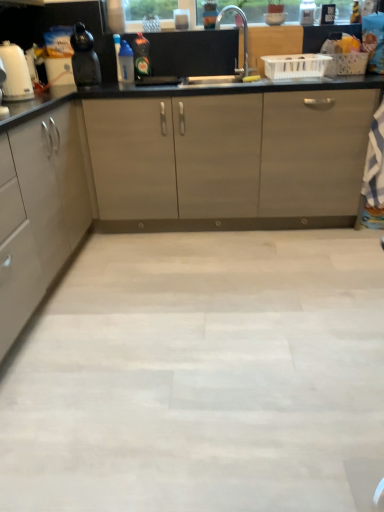
Question: Does matte black kettle at left contain white glossy kettle at left?

Choices:
 (A) yes
 (B) no

Answer: (B)

Question: Can you confirm if matte black kettle at left is shorter than white glossy kettle at left?

Choices:
 (A) no
 (B) yes

Answer: (A)

Question: Is matte black kettle at left behind white glossy kettle at left?

Choices:
 (A) yes
 (B) no

Answer: (A)

Question: Is matte black kettle at left taller than white glossy kettle at left?

Choices:
 (A) yes
 (B) no

Answer: (A)

Question: Is matte black kettle at left turned away from white glossy kettle at left?

Choices:
 (A) no
 (B) yes

Answer: (A)

Question: In terms of height, does silver metallic faucet at upper center look taller or shorter compared to matte gray cabinet at left?

Choices:
 (A) short
 (B) tall

Answer: (A)

Question: From the image's perspective, is silver metallic faucet at upper center located above or below matte gray cabinet at left?

Choices:
 (A) below
 (B) above

Answer: (B)

Question: Considering their positions, is silver metallic faucet at upper center located in front of or behind matte gray cabinet at left?

Choices:
 (A) behind
 (B) front

Answer: (A)

Question: Considering the positions of silver metallic faucet at upper center and matte gray cabinet at left in the image, is silver metallic faucet at upper center bigger or smaller than matte gray cabinet at left?

Choices:
 (A) small
 (B) big

Answer: (A)

Question: Considering the positions of point (91, 69) and point (140, 45), is point (91, 69) closer or farther from the camera than point (140, 45)?

Choices:
 (A) closer
 (B) farther

Answer: (A)

Question: From a real-world perspective, is matte black kettle at left positioned above or below green glass bottle at center, acting as the 1th bottle starting from the right?

Choices:
 (A) below
 (B) above

Answer: (B)

Question: Looking at their shapes, would you say matte black kettle at left is wider or thinner than green glass bottle at center, acting as the 1th bottle starting from the right?

Choices:
 (A) wide
 (B) thin

Answer: (A)

Question: Is matte black kettle at left in front of or behind green glass bottle at center, the 2th bottle positioned from the left, in the image?

Choices:
 (A) front
 (B) behind

Answer: (A)

Question: Is white glossy kettle at left inside or outside of green glass bottle at center, the 2th bottle positioned from the left?

Choices:
 (A) outside
 (B) inside

Answer: (A)

Question: In terms of size, does white glossy kettle at left appear bigger or smaller than green glass bottle at center, the 2th bottle positioned from the left?

Choices:
 (A) small
 (B) big

Answer: (B)